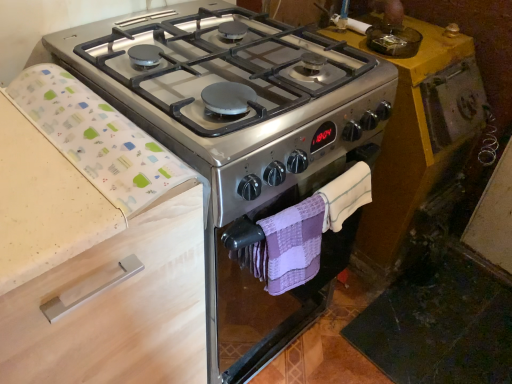
Where is `beige wood drawer at left`? This screenshot has width=512, height=384. beige wood drawer at left is located at coordinates (117, 308).

The image size is (512, 384). What do you see at coordinates (219, 73) in the screenshot?
I see `satin silver gas stove at center` at bounding box center [219, 73].

Image resolution: width=512 pixels, height=384 pixels. In order to click on purple woven hand towel at center, which is the first hand towel in right-to-left order in this screenshot , I will do `click(345, 195)`.

What do you see at coordinates (290, 246) in the screenshot? I see `purple woven hand towel at lower center, which is the 1th hand towel in left-to-right order` at bounding box center [290, 246].

I want to click on white fabric at left, so click(x=97, y=138).

Between purple woven hand towel at center, which is the first hand towel in right-to-left order, and beige wood drawer at left, which one has larger width?

With larger width is beige wood drawer at left.

Which is in front, purple woven hand towel at center, which is the first hand towel in right-to-left order, or beige wood drawer at left?

beige wood drawer at left is closer to the camera.

From the image's perspective, which one is positioned higher, purple woven hand towel at center, the 2th hand towel viewed from the left, or beige wood drawer at left?

purple woven hand towel at center, the 2th hand towel viewed from the left, appears higher in the image.

Considering the points (362, 170) and (148, 367), which point is behind, point (362, 170) or point (148, 367)?

Positioned behind is point (362, 170).

Is beige wood drawer at left looking in the opposite direction of purple woven hand towel at center, which is the first hand towel in right-to-left order?

beige wood drawer at left is not turned away from purple woven hand towel at center, which is the first hand towel in right-to-left order.

Is purple woven hand towel at center, which is the first hand towel in right-to-left order, located within beige wood drawer at left?

Actually, purple woven hand towel at center, which is the first hand towel in right-to-left order, is outside beige wood drawer at left.

From the image's perspective, is beige wood drawer at left below purple woven hand towel at center, which is the first hand towel in right-to-left order?

Yes, from the image's perspective, beige wood drawer at left is below purple woven hand towel at center, which is the first hand towel in right-to-left order.

Does point (80, 315) appear closer or farther from the camera than point (103, 184)?

Point (80, 315).

Based on the photo, from the image's perspective, is beige wood drawer at left above or below white fabric at left?

From the image's perspective, beige wood drawer at left appears below white fabric at left.

Consider the image. Considering the relative positions of beige wood drawer at left and white fabric at left in the image provided, is beige wood drawer at left in front of white fabric at left?

That is True.

The height and width of the screenshot is (384, 512). I want to click on drawer lying below the white fabric at left (from the image's perspective), so click(x=117, y=308).

From a real-world perspective, between satin silver gas stove at center and beige wood drawer at left, who is vertically lower?

beige wood drawer at left, from a real-world perspective.

Where is `gas stove above the beige wood drawer at left (from the image's perspective)`? The image size is (512, 384). gas stove above the beige wood drawer at left (from the image's perspective) is located at coordinates (219, 73).

From the image's perspective, which object appears higher, satin silver gas stove at center or beige wood drawer at left?

satin silver gas stove at center.

Between satin silver gas stove at center and beige wood drawer at left, which one is positioned in front?

beige wood drawer at left.

From a real-world perspective, which object rests below the other?

purple woven hand towel at lower center, which is the second hand towel from right to left, from a real-world perspective.

Between purple woven hand towel at lower center, which is the 1th hand towel in left-to-right order, and white fabric at left, which one is positioned behind?

purple woven hand towel at lower center, which is the 1th hand towel in left-to-right order, is more distant.

In the scene shown: Does purple woven hand towel at lower center, which is the 1th hand towel in left-to-right order, appear on the right side of white fabric at left?

Indeed, purple woven hand towel at lower center, which is the 1th hand towel in left-to-right order, is positioned on the right side of white fabric at left.

Measure the distance from purple woven hand towel at lower center, which is the second hand towel from right to left, to white fabric at left.

A distance of 30.86 centimeters exists between purple woven hand towel at lower center, which is the second hand towel from right to left, and white fabric at left.

From a real-world perspective, which hand towel is the 2nd one underneath the white fabric at left? Please provide its 2D coordinates.

[(290, 246)]

Which object is thinner, white fabric at left or purple woven hand towel at lower center, which is the second hand towel from right to left?

Thinner between the two is purple woven hand towel at lower center, which is the second hand towel from right to left.

Is white fabric at left looking in the opposite direction of purple woven hand towel at lower center, which is the 1th hand towel in left-to-right order?

That's not correct — white fabric at left is not looking away from purple woven hand towel at lower center, which is the 1th hand towel in left-to-right order.

Considering the sizes of objects white fabric at left and purple woven hand towel at lower center, which is the second hand towel from right to left, in the image provided, who is shorter, white fabric at left or purple woven hand towel at lower center, which is the second hand towel from right to left,?

Standing shorter between the two is white fabric at left.

Is point (266, 248) positioned before point (379, 70)?

Yes, it is in front of point (379, 70).

Who is taller, purple woven hand towel at lower center, which is the 1th hand towel in left-to-right order, or satin silver gas stove at center?

With more height is purple woven hand towel at lower center, which is the 1th hand towel in left-to-right order.

Considering the sizes of objects purple woven hand towel at lower center, which is the 1th hand towel in left-to-right order, and satin silver gas stove at center in the image provided, who is wider, purple woven hand towel at lower center, which is the 1th hand towel in left-to-right order, or satin silver gas stove at center?

With larger width is satin silver gas stove at center.

Is satin silver gas stove at center surrounded by purple woven hand towel at lower center, which is the second hand towel from right to left?

No, satin silver gas stove at center is not inside purple woven hand towel at lower center, which is the second hand towel from right to left.

The width and height of the screenshot is (512, 384). I want to click on drawer lying on the left of purple woven hand towel at center, the 2th hand towel viewed from the left, so click(117, 308).

Where is `drawer below the purple woven hand towel at center, which is the first hand towel in right-to-left order (from the image's perspective)`? Image resolution: width=512 pixels, height=384 pixels. drawer below the purple woven hand towel at center, which is the first hand towel in right-to-left order (from the image's perspective) is located at coordinates (117, 308).

From the image, which object appears to be nearer to white fabric at left, beige wood drawer at left or purple woven hand towel at lower center, which is the 1th hand towel in left-to-right order?

Based on the image, beige wood drawer at left appears to be nearer to white fabric at left.

Looking at the image, which one is located closer to beige wood drawer at left, purple woven hand towel at center, the 2th hand towel viewed from the left, or satin silver gas stove at center?

Among the two, satin silver gas stove at center is located nearer to beige wood drawer at left.

Based on their spatial positions, is satin silver gas stove at center or purple woven hand towel at lower center, which is the second hand towel from right to left, further from beige wood drawer at left?

satin silver gas stove at center lies further to beige wood drawer at left than the other object.

Estimate the real-world distances between objects in this image. Which object is further from beige wood drawer at left, satin silver gas stove at center or white fabric at left?

satin silver gas stove at center lies further to beige wood drawer at left than the other object.

From the image, which object appears to be farther from beige wood drawer at left, purple woven hand towel at center, the 2th hand towel viewed from the left, or purple woven hand towel at lower center, which is the second hand towel from right to left?

Among the two, purple woven hand towel at center, the 2th hand towel viewed from the left, is located further to beige wood drawer at left.

Considering their positions, is beige wood drawer at left positioned closer to satin silver gas stove at center than purple woven hand towel at lower center, which is the second hand towel from right to left?

purple woven hand towel at lower center, which is the second hand towel from right to left.

Considering their positions, is white fabric at left positioned closer to purple woven hand towel at center, which is the first hand towel in right-to-left order, than beige wood drawer at left?

beige wood drawer at left is positioned closer to the anchor purple woven hand towel at center, which is the first hand towel in right-to-left order.

From the image, which object appears to be farther from purple woven hand towel at center, which is the first hand towel in right-to-left order, white fabric at left or satin silver gas stove at center?

The object further to purple woven hand towel at center, which is the first hand towel in right-to-left order, is white fabric at left.

The width and height of the screenshot is (512, 384). I want to click on hand towel between satin silver gas stove at center and purple woven hand towel at lower center, which is the 1th hand towel in left-to-right order, in the vertical direction, so click(x=345, y=195).

You are a GUI agent. You are given a task and a screenshot of the screen. Output one action in this format:
    pyautogui.click(x=<x>, y=<y>)
    Task: Click on the hand towel located between white fabric at left and purple woven hand towel at center, the 2th hand towel viewed from the left, in the left-right direction
    
    Given the screenshot: What is the action you would take?
    pyautogui.click(x=290, y=246)

The height and width of the screenshot is (384, 512). I want to click on gas stove situated between white fabric at left and purple woven hand towel at center, the 2th hand towel viewed from the left, from left to right, so click(x=219, y=73).

Where is `gas stove between beige wood drawer at left and purple woven hand towel at center, the 2th hand towel viewed from the left, in the horizontal direction`? The width and height of the screenshot is (512, 384). gas stove between beige wood drawer at left and purple woven hand towel at center, the 2th hand towel viewed from the left, in the horizontal direction is located at coordinates (219, 73).